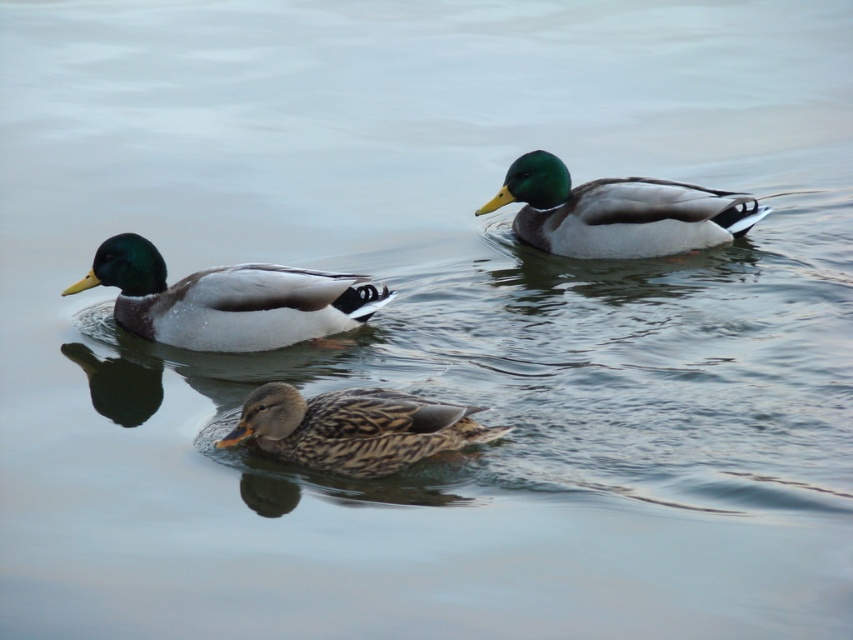
Question: Which object is closer to the camera taking this photo?

Choices:
 (A) shiny brown duck at center
 (B) green glossy duck at upper right

Answer: (A)

Question: Where is shiny brown duck at center located in relation to brown speckled duck at center in the image?

Choices:
 (A) above
 (B) below

Answer: (A)

Question: Can you confirm if green glossy duck at upper right is bigger than brown speckled duck at center?

Choices:
 (A) yes
 (B) no

Answer: (A)

Question: Which point is farther from the camera taking this photo?

Choices:
 (A) (288, 454)
 (B) (119, 300)
 (C) (506, 189)

Answer: (C)

Question: Can you confirm if shiny brown duck at center is positioned below green glossy duck at upper right?

Choices:
 (A) yes
 (B) no

Answer: (A)

Question: Among these objects, which one is farthest from the camera?

Choices:
 (A) shiny brown duck at center
 (B) brown speckled duck at center
 (C) green glossy duck at upper right

Answer: (C)